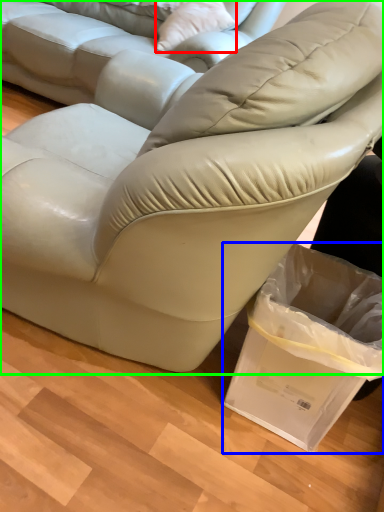
Question: Which object is the farthest from throw pillow (highlighted by a red box)? Choose among these: shopping bag (highlighted by a blue box) or studio couch (highlighted by a green box).

Choices:
 (A) shopping bag
 (B) studio couch

Answer: (A)